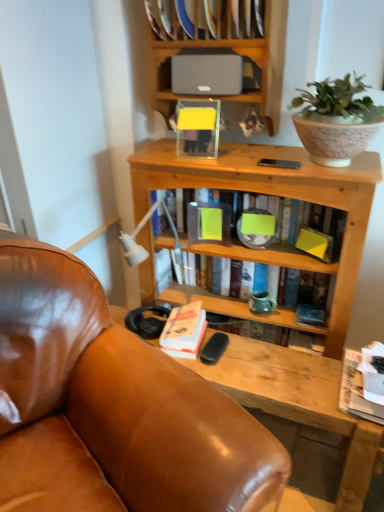
Question: Is hardcover book at center, acting as the 2th book starting from the top, smaller than matte green book at center, which is the first book from top to bottom?

Choices:
 (A) yes
 (B) no

Answer: (A)

Question: From the image's perspective, does hardcover book at center, marked as the 3th book in a bottom-to-top arrangement, appear higher than matte green book at center, which is the first book from top to bottom?

Choices:
 (A) yes
 (B) no

Answer: (B)

Question: Does hardcover book at center, acting as the 2th book starting from the top, lie behind matte green book at center, which is the first book from top to bottom?

Choices:
 (A) yes
 (B) no

Answer: (A)

Question: Is hardcover book at center, marked as the 3th book in a bottom-to-top arrangement, in contact with matte green book at center, which is the fourth book from bottom to top?

Choices:
 (A) no
 (B) yes

Answer: (A)

Question: From the image's perspective, is hardcover book at center, marked as the 3th book in a bottom-to-top arrangement, beneath matte green book at center, which is the first book from top to bottom?

Choices:
 (A) yes
 (B) no

Answer: (A)

Question: Is matte green book at center, which is the first book from top to bottom, situated inside satin gray speaker at upper center or outside?

Choices:
 (A) outside
 (B) inside

Answer: (A)

Question: Considering the relative positions of matte green book at center, which is the fourth book from bottom to top, and satin gray speaker at upper center in the image provided, is matte green book at center, which is the fourth book from bottom to top, to the left or to the right of satin gray speaker at upper center?

Choices:
 (A) left
 (B) right

Answer: (B)

Question: Considering the positions of matte green book at center, which is the first book from top to bottom, and satin gray speaker at upper center in the image, is matte green book at center, which is the first book from top to bottom, taller or shorter than satin gray speaker at upper center?

Choices:
 (A) tall
 (B) short

Answer: (A)

Question: Looking at their shapes, would you say matte green book at center, which is the fourth book from bottom to top, is wider or thinner than satin gray speaker at upper center?

Choices:
 (A) thin
 (B) wide

Answer: (B)

Question: Looking at the image, does satin gray speaker at upper center seem bigger or smaller compared to matte gray speaker at upper center?

Choices:
 (A) small
 (B) big

Answer: (A)

Question: Is satin gray speaker at upper center inside the boundaries of matte gray speaker at upper center, or outside?

Choices:
 (A) inside
 (B) outside

Answer: (A)

Question: Is point (221, 82) closer or farther from the camera than point (196, 9)?

Choices:
 (A) closer
 (B) farther

Answer: (B)

Question: Is satin gray speaker at upper center taller or shorter than matte gray speaker at upper center?

Choices:
 (A) short
 (B) tall

Answer: (A)

Question: In the image, is brown leather chair at center positioned in front of or behind white paper at lower right, placed as the 4th book when sorted from top to bottom?

Choices:
 (A) front
 (B) behind

Answer: (A)

Question: Considering the positions of point (112, 333) and point (349, 404), is point (112, 333) closer or farther from the camera than point (349, 404)?

Choices:
 (A) closer
 (B) farther

Answer: (B)